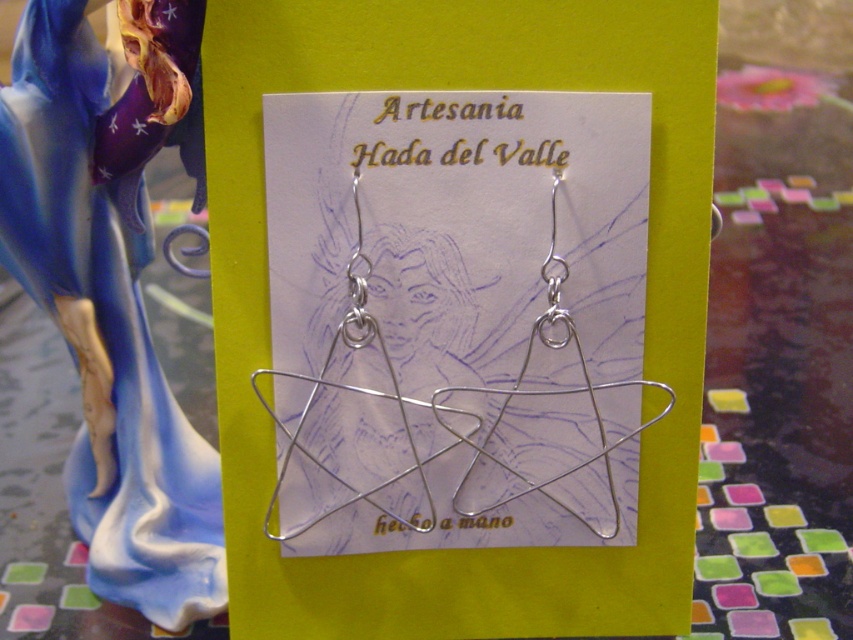
You are a customer at a craft fair and see the matte porcelain figure at left and the silver wire star at center. Which object would you need to handle with more care due to its size?

The matte porcelain figure at left requires more care because it is larger than the silver wire star at center, making it potentially heavier and more prone to damage if mishandled.

You are a customer in a craft store and see the matte porcelain figure at left and the silver wire star at center. Which object is closer to you?

The matte porcelain figure at left is closer to you because it is in front of the silver wire star at center.